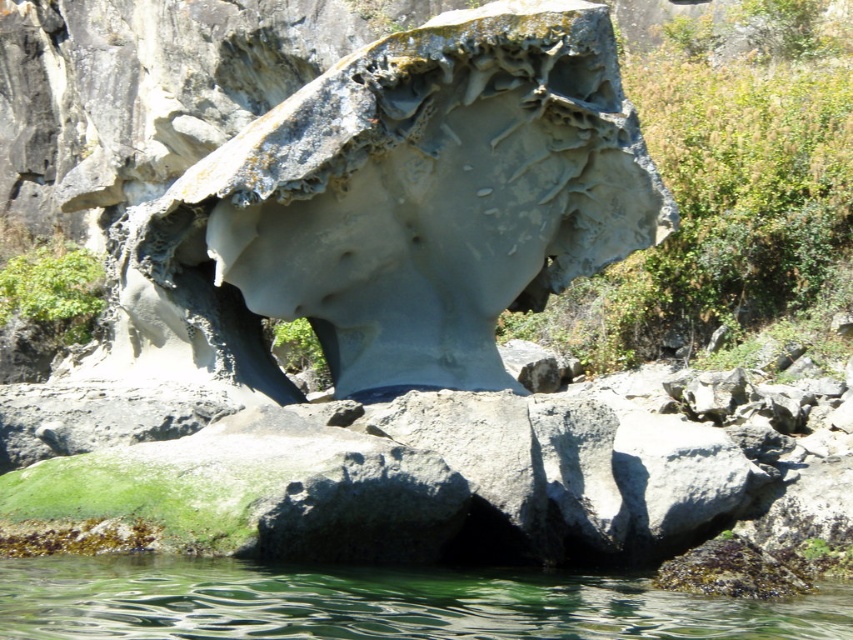
You are a photographer planning to take a photo of the gray stone sculpture at center and the clear water at lower center. You want to ensure both are in focus. If your camera has a depth of field that can cover 15 meters, will you be able to capture both objects sharply?

The gray stone sculpture at center and clear water at lower center are 14.52 meters apart from each other. Since the distance between them is within the camera depth of field range of 15 meters, you can capture both objects sharply.

You are a photographer planning to capture the gray stone sculpture at center and the clear water at lower center in a single frame. Which object will occupy more horizontal space in the photo?

The clear water at lower center will occupy more horizontal space in the photo because the gray stone sculpture at center has a lesser width compared to it.

You are an artist planning to paint this scene. You want to ensure the gray stone sculpture at center and the clear water at lower center are proportionally accurate. Based on their sizes in the image, which object should you depict as larger?

The gray stone sculpture at center should be depicted as larger since it is bigger than the clear water at lower center according to the description.